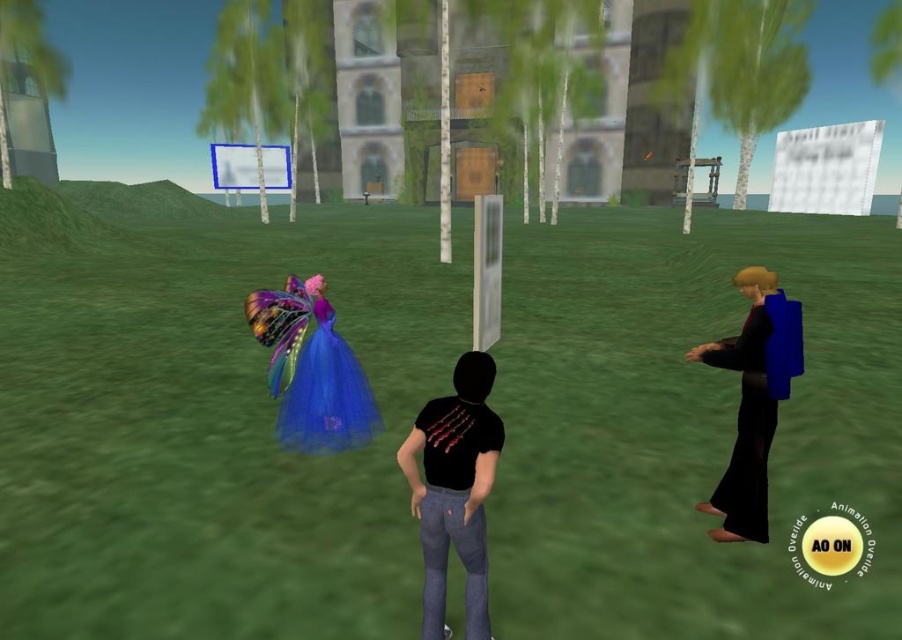
Does black matte dress at right have a lesser width compared to metallic blue sign at upper center?

Yes.

Is point (748, 460) in front of point (269, 168)?

Yes.

Find the location of a particular element. black matte dress at right is located at coordinates (753, 401).

Can you confirm if black matte t-shirt at center is positioned above metallic blue sign at upper center?

No, black matte t-shirt at center is not above metallic blue sign at upper center.

Is black matte t-shirt at center shorter than metallic blue sign at upper center?

Yes.

Locate an element on the screen. The height and width of the screenshot is (640, 902). black matte t-shirt at center is located at coordinates (454, 490).

Where is `black matte t-shirt at center`? black matte t-shirt at center is located at coordinates (454, 490).

Can you confirm if shiny blue dress at center is positioned to the right of metallic blue sign at upper center?

Yes, shiny blue dress at center is to the right of metallic blue sign at upper center.

Is shiny blue dress at center positioned in front of metallic blue sign at upper center?

Yes, shiny blue dress at center is in front of metallic blue sign at upper center.

Is point (284, 296) positioned before point (278, 182)?

Yes, point (284, 296) is in front of point (278, 182).

I want to click on shiny blue dress at center, so click(311, 369).